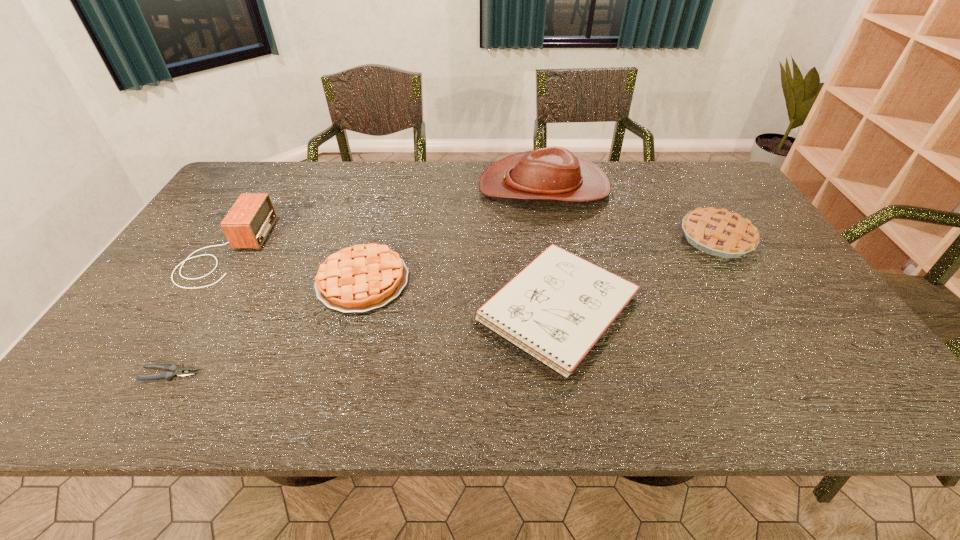
Locate an element on the screen. The image size is (960, 540). empty space between the left pie and the radio receiver is located at coordinates (294, 266).

Find the location of a particular element. free space between the radio receiver and the rightmost object is located at coordinates (470, 244).

This screenshot has width=960, height=540. I want to click on free point between the farthest object and the left pie, so click(x=453, y=234).

Where is `free area in between the rightmost object and the pliers`? free area in between the rightmost object and the pliers is located at coordinates (444, 306).

Locate an element on the screen. empty space that is in between the left pie and the fifth shortest object is located at coordinates point(294,266).

Where is `free space between the shortest object and the notepad`? free space between the shortest object and the notepad is located at coordinates (364, 341).

You are a GUI agent. You are given a task and a screenshot of the screen. Output one action in this format:
    pyautogui.click(x=<x>, y=<y>)
    Task: Click on the object identified as the closest to the shortest object
    Image resolution: width=960 pixels, height=540 pixels.
    Given the screenshot: What is the action you would take?
    pyautogui.click(x=363, y=277)

I want to click on object identified as the fifth closest to the radio receiver, so click(718, 232).

This screenshot has height=540, width=960. What are the coordinates of `vacant space that satisfies the following two spatial constraints: 1. on the front side of the left pie; 2. at the gripping part of the shortest object` in the screenshot? It's located at (337, 374).

The height and width of the screenshot is (540, 960). What are the coordinates of `free region that satisfies the following two spatial constraints: 1. on the front-facing side of the second tallest object; 2. on the left side of the notepad` in the screenshot? It's located at (188, 309).